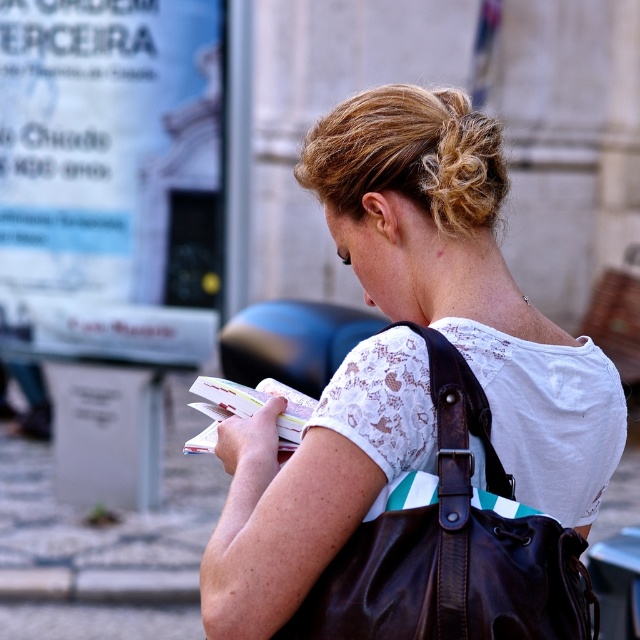
You are a photographer trying to capture a closeup of the white lace shirt at center and the blonde hair at upper center in the image. Can you fit both subjects into the frame if your camera has a maximum width of 24 centimeters?

The white lace shirt at center and the blonde hair at upper center are 23.70 centimeters apart, so yes, both subjects can fit into the frame since the distance between them is less than the camera frame width of 24 centimeters.

You are a photographer trying to capture the woman reading a book. You notice the blonde hair at upper center and the leather strap at back. Which object should you focus on first if you want to capture the leftmost part of the scene?

The blonde hair at upper center is to the left of the leather strap at back, so you should focus on the blonde hair at upper center first to capture the leftmost part of the scene.